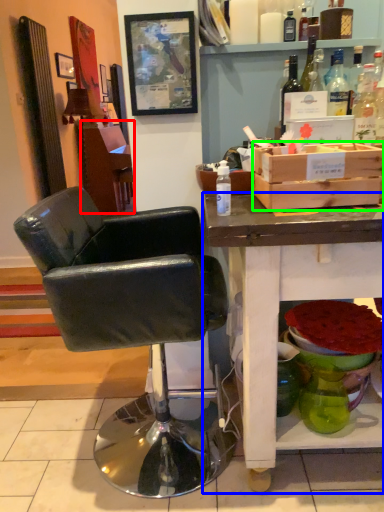
Question: Based on their relative distances, which object is farther from vanity (highlighted by a red box)? Choose from desk (highlighted by a blue box) and box (highlighted by a green box).

Choices:
 (A) desk
 (B) box

Answer: (A)